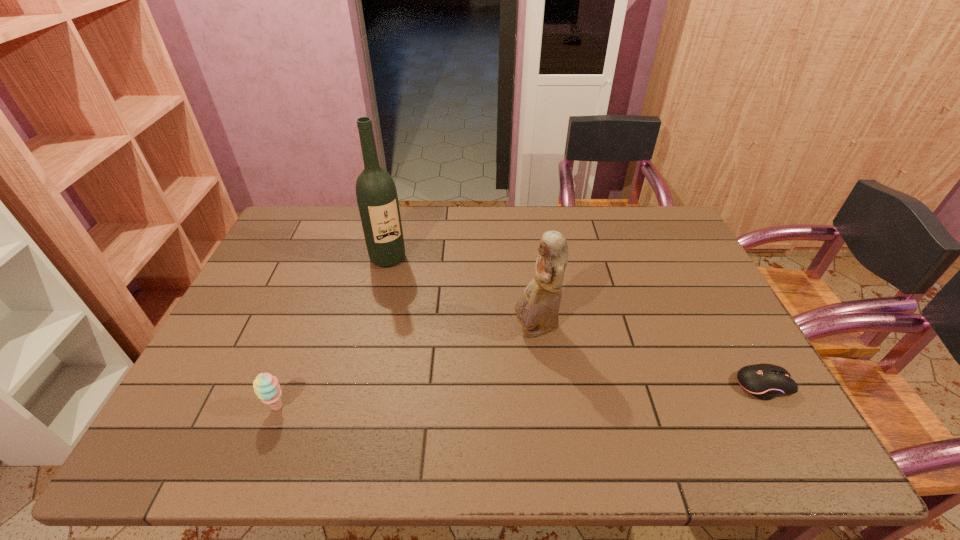
I want to click on free location at the far edge of the desktop, so click(x=605, y=228).

Where is `vacant region at the near edge of the desktop`? The height and width of the screenshot is (540, 960). vacant region at the near edge of the desktop is located at coordinates (x=458, y=399).

You are a GUI agent. You are given a task and a screenshot of the screen. Output one action in this format:
    pyautogui.click(x=<x>, y=<y>)
    Task: Click on the blank space at the left edge
    The image size is (960, 540).
    Given the screenshot: What is the action you would take?
    pyautogui.click(x=228, y=358)

At what (x,y) coordinates should I click in order to perform the action: click on free point at the right edge. Please return your answer as a coordinate pair (x, y). The width and height of the screenshot is (960, 540). Looking at the image, I should click on (706, 282).

This screenshot has width=960, height=540. In order to click on vacant region at the far left corner of the desktop in this screenshot , I will do `click(320, 236)`.

This screenshot has width=960, height=540. I want to click on free region at the far right corner, so click(664, 246).

Image resolution: width=960 pixels, height=540 pixels. Find the location of `empty space between the computer mouse and the third shortest object`. empty space between the computer mouse and the third shortest object is located at coordinates (650, 357).

The image size is (960, 540). In order to click on free space between the wine bottle and the sherbert in this screenshot , I will do `click(333, 333)`.

Find the location of a particular element. The image size is (960, 540). vacant area that lies between the second object from left to right and the third nearest object is located at coordinates (462, 294).

Identify the location of vacant area that lies between the farthest object and the rightmost object. The height and width of the screenshot is (540, 960). (576, 322).